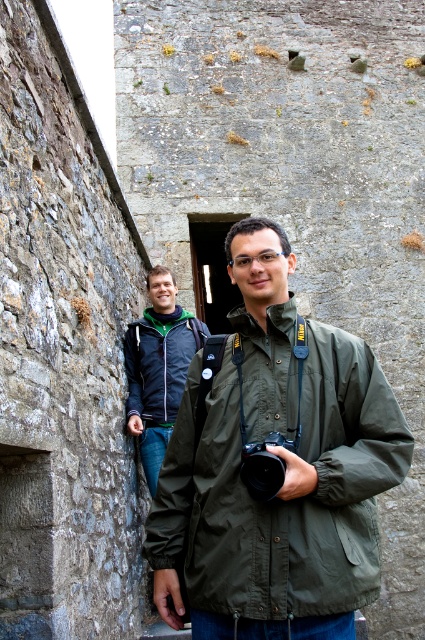
Question: Among these points, which one is farthest from the camera?

Choices:
 (A) (172, 353)
 (B) (316, 465)

Answer: (A)

Question: Is olive green fabric jacket at center thinner than dark blue jacket at center?

Choices:
 (A) yes
 (B) no

Answer: (B)

Question: Which of the following is the farthest from the observer?

Choices:
 (A) (150, 358)
 (B) (354, 364)

Answer: (A)

Question: Does olive green fabric jacket at center have a lesser width compared to dark blue jacket at center?

Choices:
 (A) yes
 (B) no

Answer: (B)

Question: Can you confirm if olive green fabric jacket at center is wider than dark blue jacket at center?

Choices:
 (A) yes
 (B) no

Answer: (A)